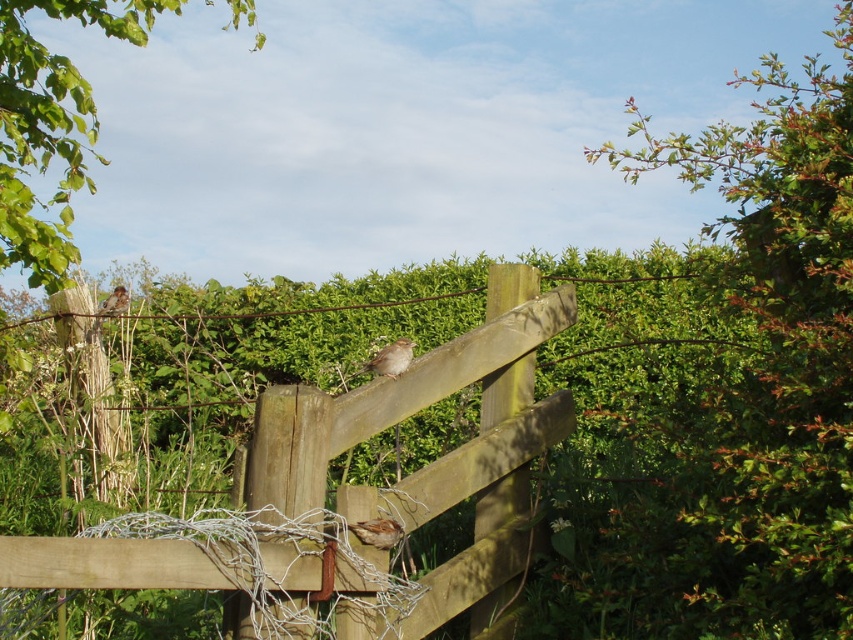
Question: Does brown speckled sparrow at center have a smaller size compared to brown matte sparrow at upper left?

Choices:
 (A) no
 (B) yes

Answer: (B)

Question: Which object appears farthest from the camera in this image?

Choices:
 (A) brown speckled sparrow at center
 (B) brown matte sparrow at upper left
 (C) brown feathered sparrow at center
 (D) wooden fence at center

Answer: (B)

Question: Is brown speckled sparrow at center below brown matte sparrow at upper left?

Choices:
 (A) yes
 (B) no

Answer: (A)

Question: Among these points, which one is farthest from the camera?

Choices:
 (A) (395, 376)
 (B) (99, 310)
 (C) (364, 410)
 (D) (373, 544)

Answer: (B)

Question: Which object is the closest to the brown matte sparrow at upper left?

Choices:
 (A) brown feathered sparrow at center
 (B) brown speckled sparrow at center
 (C) wooden fence at center

Answer: (A)

Question: From the image, what is the correct spatial relationship of wooden fence at center in relation to brown feathered sparrow at center?

Choices:
 (A) below
 (B) above

Answer: (A)